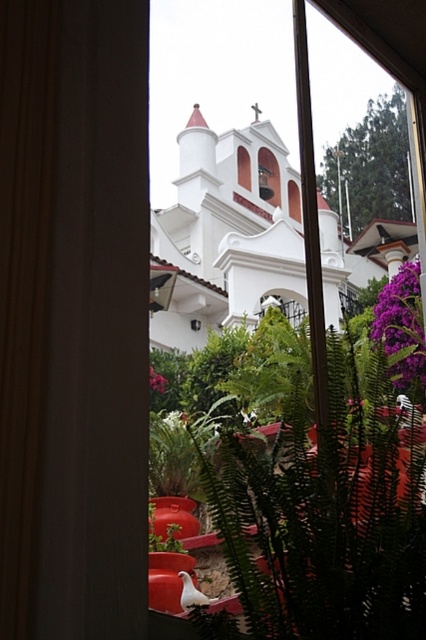
You are standing in front of the window shown in the image. You want to place a small statue exactly at the point marked by point (227,232). What object will the statue be placed on?

The point (227,232) marks the white matte church at center, so the statue will be placed on the white matte church at center.

You are standing in front of the church and looking through the window. There is a point marked at coordinates [192,593]. What object is located at that point?

The point at coordinates [192,593] corresponds to the white glossy bird at lower center.

You are an ornithologist observing the scene through the window. You notice the white glossy bird at lower center and the purple matte flower at right. Which object is positioned higher in the frame?

The purple matte flower at right is positioned higher than the white glossy bird at lower center in the frame.